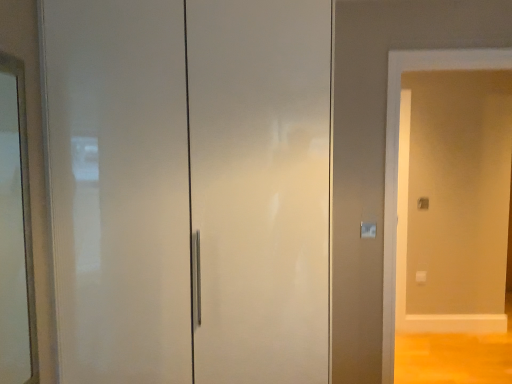
Question: From a real-world perspective, is matte white screen door at right below white glossy door at center?

Choices:
 (A) yes
 (B) no

Answer: (A)

Question: From the image's perspective, would you say matte white screen door at right is shown under white glossy door at center?

Choices:
 (A) yes
 (B) no

Answer: (A)

Question: Would you consider matte white screen door at right to be distant from white glossy door at center?

Choices:
 (A) yes
 (B) no

Answer: (A)

Question: Does matte white screen door at right have a lesser width compared to white glossy door at center?

Choices:
 (A) yes
 (B) no

Answer: (A)

Question: Can you confirm if matte white screen door at right is positioned to the left of white glossy door at center?

Choices:
 (A) no
 (B) yes

Answer: (A)

Question: From a real-world perspective, relative to clear glass mirror at left, is matte white screen door at right vertically above or below?

Choices:
 (A) above
 (B) below

Answer: (B)

Question: From their relative heights in the image, would you say matte white screen door at right is taller or shorter than clear glass mirror at left?

Choices:
 (A) short
 (B) tall

Answer: (B)

Question: From the image's perspective, is matte white screen door at right positioned above or below clear glass mirror at left?

Choices:
 (A) below
 (B) above

Answer: (A)

Question: Relative to clear glass mirror at left, is matte white screen door at right in front or behind?

Choices:
 (A) front
 (B) behind

Answer: (B)

Question: Considering their positions, is clear glass mirror at left located in front of or behind white glossy door at center?

Choices:
 (A) behind
 (B) front

Answer: (B)

Question: In terms of width, does clear glass mirror at left look wider or thinner when compared to white glossy door at center?

Choices:
 (A) wide
 (B) thin

Answer: (B)

Question: Is clear glass mirror at left taller or shorter than white glossy door at center?

Choices:
 (A) short
 (B) tall

Answer: (A)

Question: Looking at the image, does clear glass mirror at left seem bigger or smaller compared to white glossy door at center?

Choices:
 (A) big
 (B) small

Answer: (B)

Question: Is point (18, 61) positioned closer to the camera than point (459, 168)?

Choices:
 (A) closer
 (B) farther

Answer: (A)

Question: In terms of height, does clear glass mirror at left look taller or shorter compared to matte white screen door at right?

Choices:
 (A) tall
 (B) short

Answer: (B)